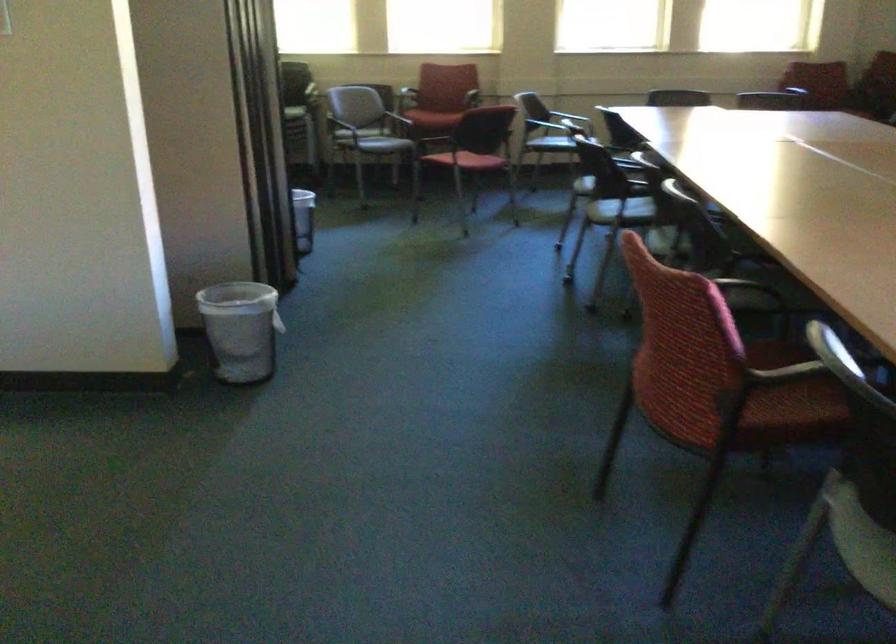
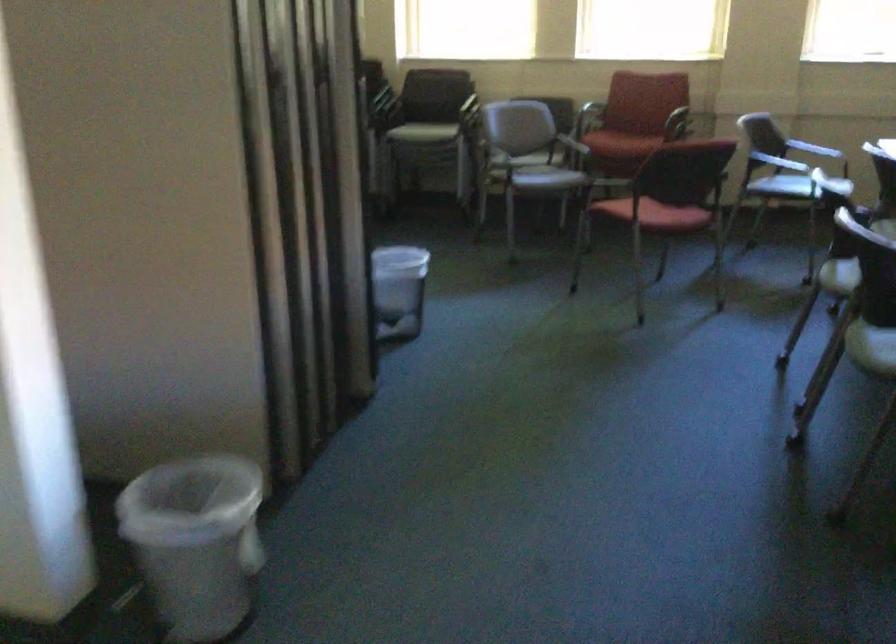
Question: I am providing you with two images of the same scene from different viewpoints. Please identify which objects are invisible in image2.

Choices:
 (A) grey chair armrest
 (B) grey chair sitting surface
 (C) red chair sitting surface
 (D) none of these

Answer: (D)